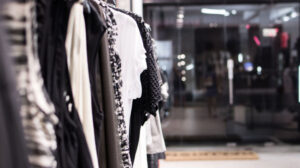
Locate an element on the screen. This screenshot has width=300, height=168. glass door is located at coordinates (207, 85).